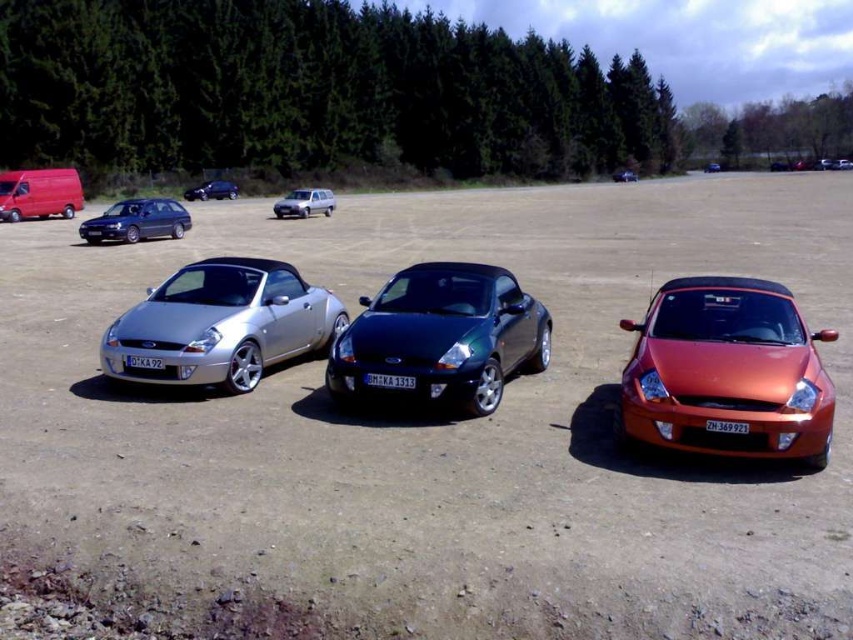
You are a photographer planning to take a photo of the glossy dark green convertible at center and the satin black sedan at upper left. You want to ensure both vehicles are in the frame. Given their sizes, which vehicle should you position closer to the camera to maintain balance in the composition?

Since the glossy dark green convertible at center is shorter than the satin black sedan at upper left, you should position the satin black sedan at upper left closer to the camera to balance their sizes in the composition.

You are a delivery driver who needs to park a new vehicle between the matte red van at upper left and the matte black hatchback at upper left. The new vehicle is 12 feet long. Can you fit it between them without overlapping either vehicle?

The distance between the matte red van at upper left and the matte black hatchback at upper left is 42.11 feet. Since the new vehicle is only 12 feet long, there is sufficient space to park it between them without overlapping either vehicle.

You are a parking attendant who needs to fit a new car into the parking lot. The new car is 1.8 meters wide. You see the satin black sedan at upper left and the glossy metallic car at center. Which of these two cars has a parking space that can accommodate the new car?

The glossy metallic car at center has a greater width than the satin black sedan at upper left. Since the new car is 1.8 meters wide, the parking space next to the glossy metallic car at center is more likely to have sufficient width to accommodate the new car.